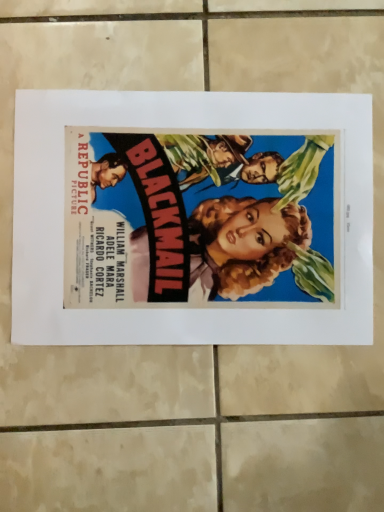
Locate an element on the screen. The width and height of the screenshot is (384, 512). free spot above matte paper poster at center (from a real-world perspective) is located at coordinates (204, 217).